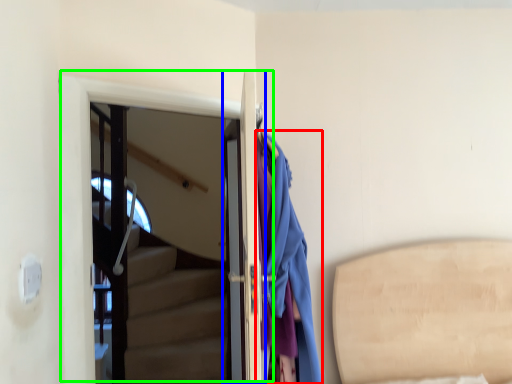
Question: Which object is positioned farthest from clothing (highlighted by a red box)? Select from door (highlighted by a blue box) and door (highlighted by a green box).

Choices:
 (A) door
 (B) door

Answer: (B)